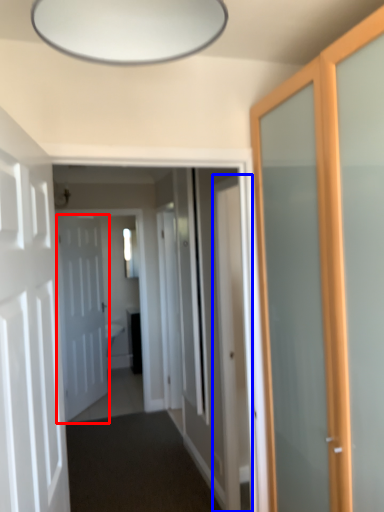
Question: Which object appears farthest to the camera in this image, door (highlighted by a red box) or door (highlighted by a blue box)?

Choices:
 (A) door
 (B) door

Answer: (A)